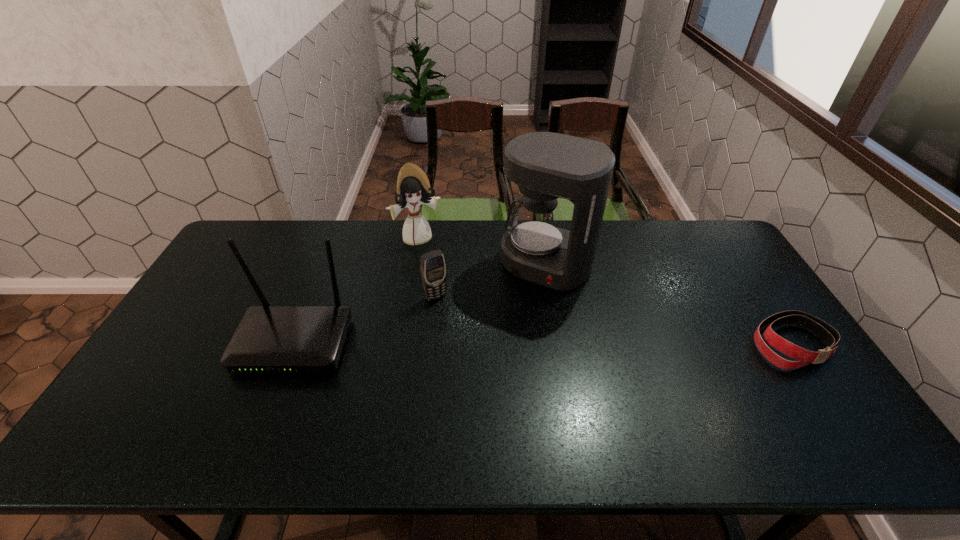
The image size is (960, 540). In order to click on vacant area located 0.170m on the front-facing side of the fourth object from left to right in this screenshot , I will do `click(507, 326)`.

Identify the location of vacant space positioned 0.340m on the front-facing side of the fourth object from left to right. (481, 368).

You are a GUI agent. You are given a task and a screenshot of the screen. Output one action in this format:
    pyautogui.click(x=<x>, y=<y>)
    Task: Click on the vacant space located on the front face of the fourth tallest object
    The image size is (960, 540).
    Given the screenshot: What is the action you would take?
    pyautogui.click(x=463, y=333)

I want to click on vacant space located 0.400m on the front face of the fourth tallest object, so [513, 401].

Where is `vacant space located 0.080m on the front face of the fourth tallest object`? The width and height of the screenshot is (960, 540). vacant space located 0.080m on the front face of the fourth tallest object is located at coordinates (453, 319).

Image resolution: width=960 pixels, height=540 pixels. Identify the location of free space located 0.080m at the front face of the doll. (432, 263).

Image resolution: width=960 pixels, height=540 pixels. What are the coordinates of `free region located 0.220m at the front face of the doll` in the screenshot? It's located at (444, 289).

At what (x,y) coordinates should I click in order to perform the action: click on vacant space situated 0.050m at the front face of the doll. Please return your answer as a coordinate pair (x, y). Looking at the image, I should click on (429, 258).

At what (x,y) coordinates should I click in order to perform the action: click on coffee maker that is at the far edge. Please return your answer as a coordinate pair (x, y). The image size is (960, 540). Looking at the image, I should click on (545, 165).

Find the location of a particular element. This screenshot has width=960, height=540. doll situated at the far edge is located at coordinates (413, 188).